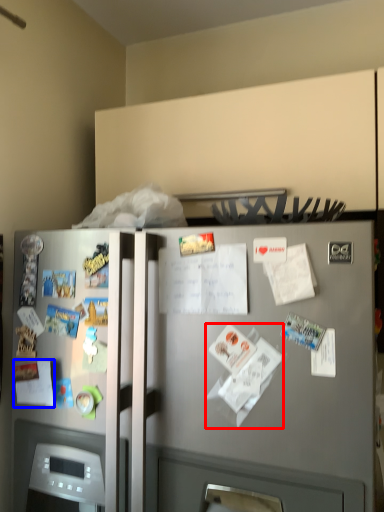
Question: Among these objects, which one is farthest to the camera, paper (highlighted by a red box) or paper (highlighted by a blue box)?

Choices:
 (A) paper
 (B) paper

Answer: (B)